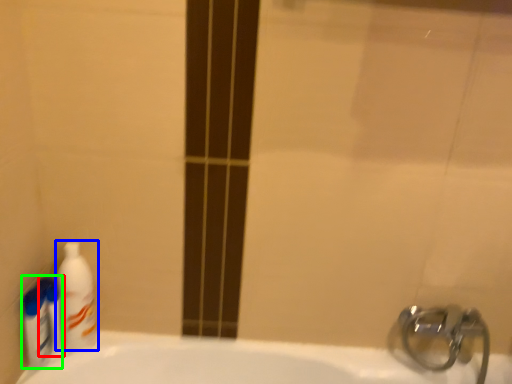
Question: Based on their relative distances, which object is nearer to mouthwash (highlighted by a red box)? Choose from cleaning product (highlighted by a blue box) and cleaning product (highlighted by a green box).

Choices:
 (A) cleaning product
 (B) cleaning product

Answer: (B)